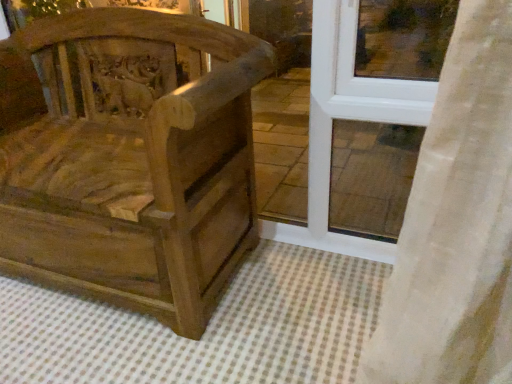
This screenshot has height=384, width=512. In order to click on polished wood chair at left in this screenshot , I will do pyautogui.click(x=134, y=162).

This screenshot has width=512, height=384. What do you see at coordinates (134, 162) in the screenshot?
I see `polished wood chair at left` at bounding box center [134, 162].

In order to face polished wood chair at left, should I rotate leftwards or rightwards?

Turn left by 21.407 degrees to look at polished wood chair at left.

The image size is (512, 384). I want to click on polished wood chair at left, so click(134, 162).